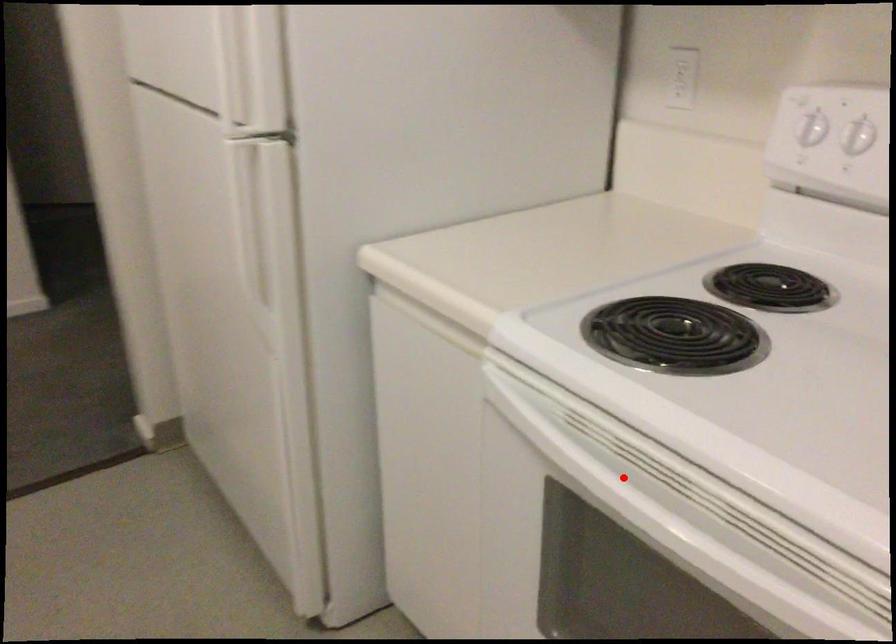
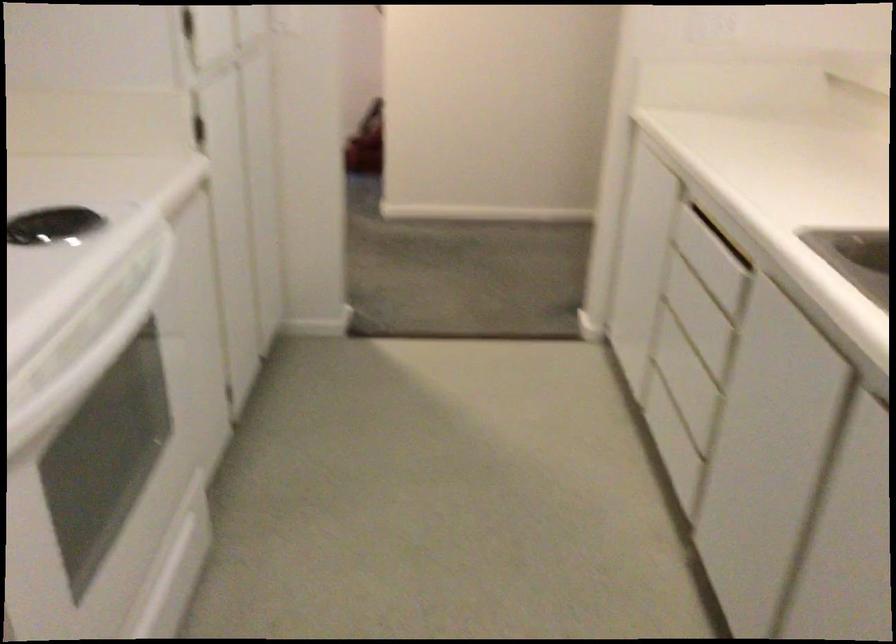
Question: I am providing you with two images of the same scene from different viewpoints. A red point is shown in image1. For the corresponding object point in image2, is it positioned nearer or farther from the camera?

Choices:
 (A) Nearer
 (B) Farther

Answer: (B)